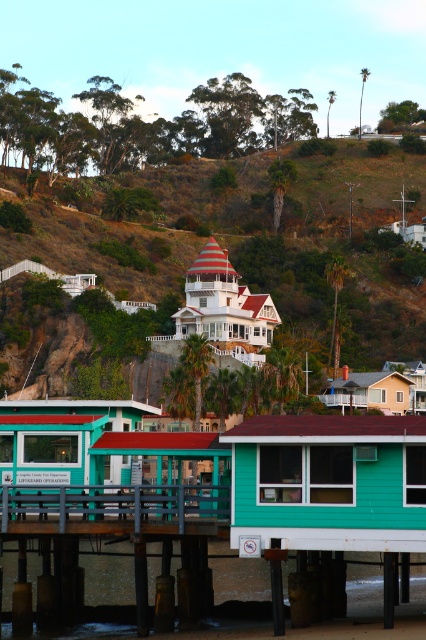
Question: Is teal wood cabin at lower center positioned before teal wood pier at lower center?

Choices:
 (A) no
 (B) yes

Answer: (B)

Question: Among these objects, which one is farthest from the camera?

Choices:
 (A) teal wood cabin at lower center
 (B) teal wood cabin at center
 (C) light brown wooden house at center

Answer: (C)

Question: Is teal wood cabin at lower center above teal wood pier at lower center?

Choices:
 (A) yes
 (B) no

Answer: (A)

Question: Estimate the real-world distances between objects in this image. Which object is farther from the teal wood cabin at center?

Choices:
 (A) teal wood cabin at lower center
 (B) teal wood pier at lower center

Answer: (A)

Question: Can you confirm if teal wood cabin at center is positioned above light brown wooden house at center?

Choices:
 (A) yes
 (B) no

Answer: (A)

Question: Which point is farther to the camera?

Choices:
 (A) light brown wooden house at center
 (B) teal wood pier at lower center

Answer: (A)